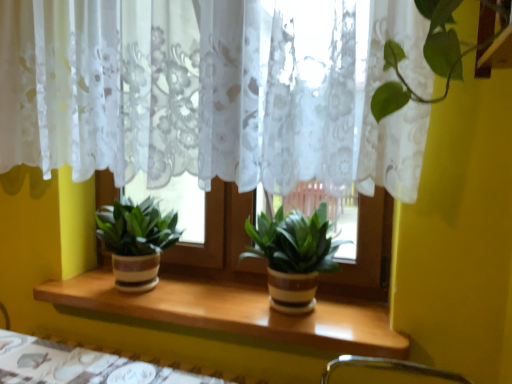
Identify the location of vacant space underneath green matte plant at center, which is counted as the first houseplant, starting from the left (from a real-world perspective). (132, 291).